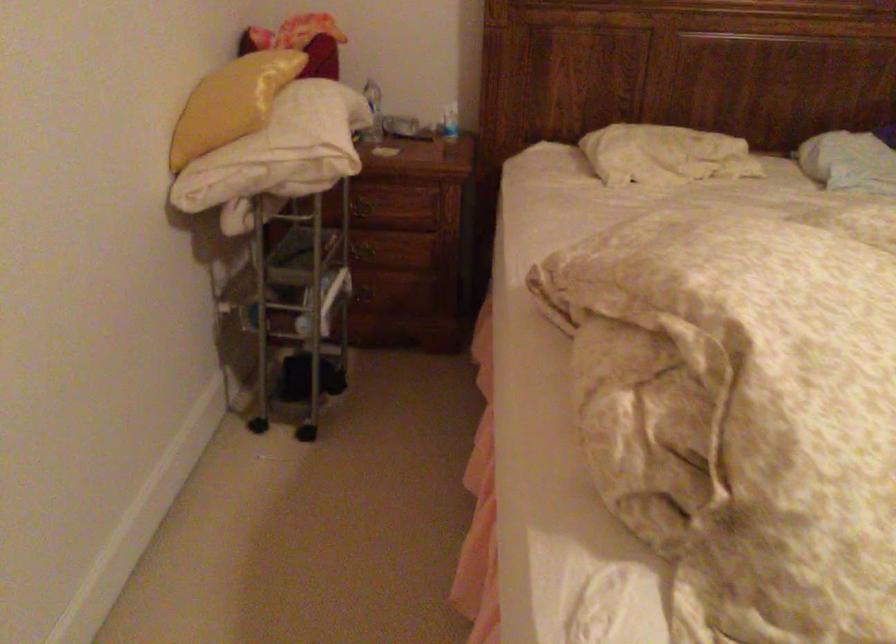
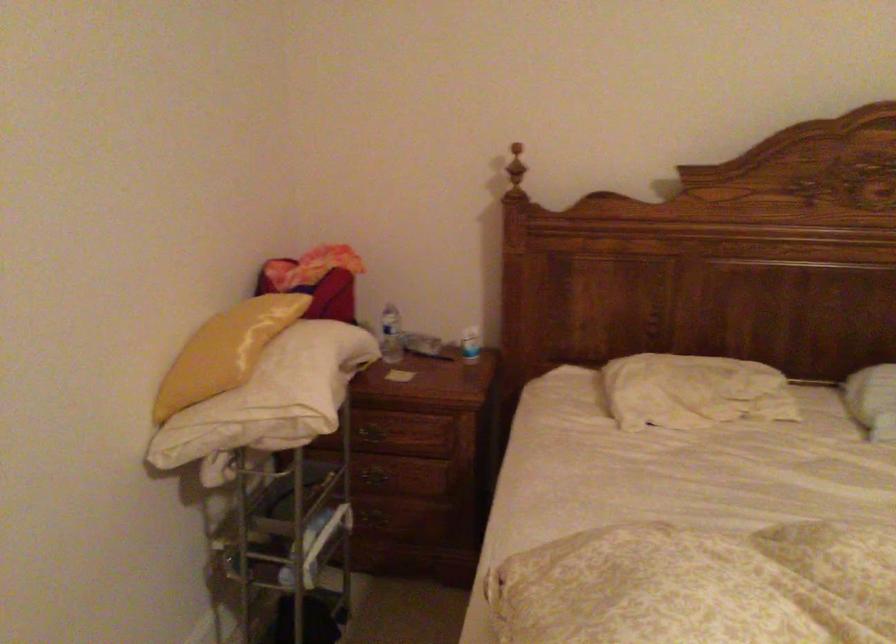
In the second image, find the point that corresponds to pixel 371 290 in the first image.

(381, 516)